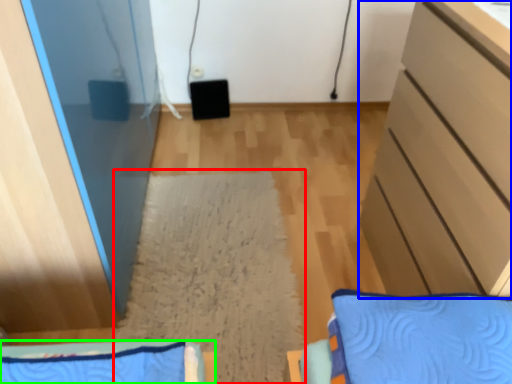
Question: Considering the real-world distances, which object is closest to mat (highlighted by a red box)? cabinetry (highlighted by a blue box) or furniture (highlighted by a green box).

Choices:
 (A) cabinetry
 (B) furniture

Answer: (B)